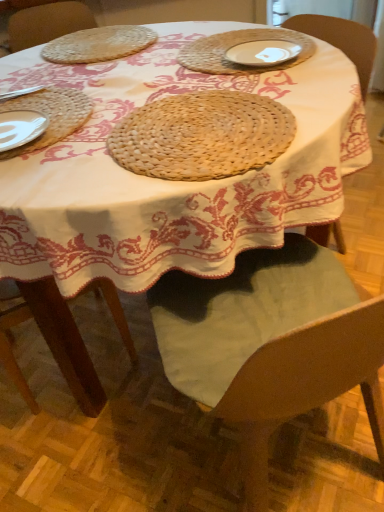
Find the location of `spots to the right of woven straw placemat at left`. spots to the right of woven straw placemat at left is located at coordinates (162, 111).